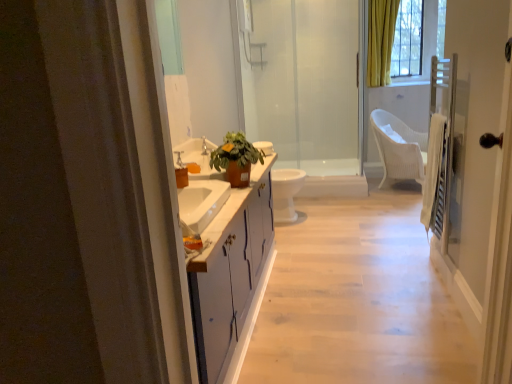
Question: Is matte brown pot at center to the right of white glossy toilet at center from the viewer's perspective?

Choices:
 (A) no
 (B) yes

Answer: (A)

Question: Considering the relative sizes of matte brown pot at center and white glossy toilet at center in the image provided, is matte brown pot at center shorter than white glossy toilet at center?

Choices:
 (A) yes
 (B) no

Answer: (A)

Question: From a real-world perspective, is matte brown pot at center positioned under white glossy toilet at center based on gravity?

Choices:
 (A) yes
 (B) no

Answer: (B)

Question: Does matte brown pot at center have a lesser width compared to white glossy toilet at center?

Choices:
 (A) no
 (B) yes

Answer: (B)

Question: From the image's perspective, is matte brown pot at center over white glossy toilet at center?

Choices:
 (A) yes
 (B) no

Answer: (A)

Question: Is matte brown pot at center wider than white glossy toilet at center?

Choices:
 (A) no
 (B) yes

Answer: (A)

Question: From the image's perspective, is transparent glass shower door at center below white glossy cabinet at center?

Choices:
 (A) no
 (B) yes

Answer: (A)

Question: Does transparent glass shower door at center have a greater width compared to white glossy cabinet at center?

Choices:
 (A) yes
 (B) no

Answer: (B)

Question: Can you confirm if transparent glass shower door at center is smaller than white glossy cabinet at center?

Choices:
 (A) yes
 (B) no

Answer: (A)

Question: Is transparent glass shower door at center at the right side of white glossy cabinet at center?

Choices:
 (A) no
 (B) yes

Answer: (A)

Question: Is transparent glass shower door at center touching white glossy cabinet at center?

Choices:
 (A) yes
 (B) no

Answer: (B)

Question: Is transparent glass shower door at center looking in the opposite direction of white glossy cabinet at center?

Choices:
 (A) no
 (B) yes

Answer: (A)

Question: From the image's perspective, is transparent glass screen door at right located beneath matte brown pot at center?

Choices:
 (A) yes
 (B) no

Answer: (A)